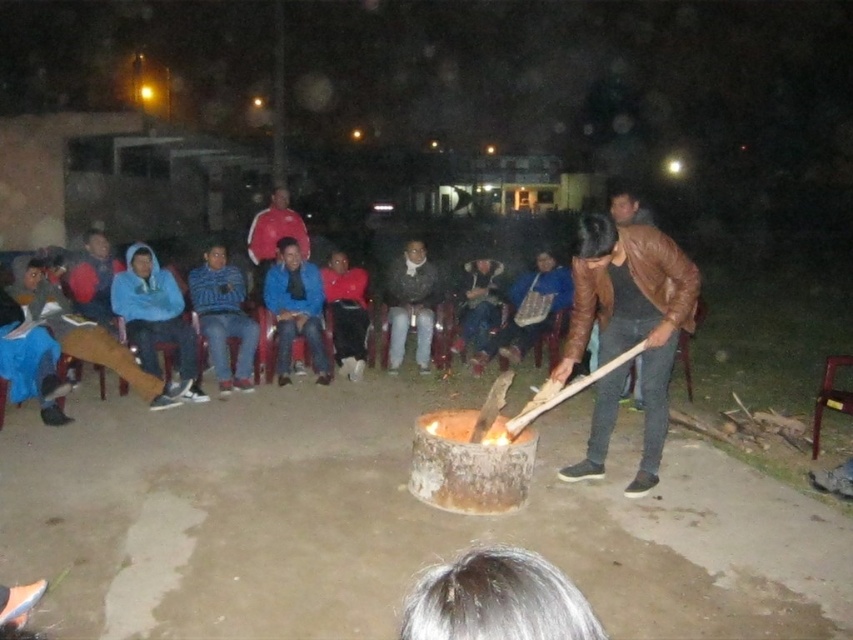
Question: Based on their relative distances, which object is farther from the red sweater at center?

Choices:
 (A) dark brown leather jacket at center
 (B) brown leather jacket at center
 (C) blue fleece jacket at center

Answer: (B)

Question: Is dark brown leather jacket at center wider than red sweater at center?

Choices:
 (A) yes
 (B) no

Answer: (A)

Question: Can you confirm if brown leather jacket at center is positioned to the right of red sweater at center?

Choices:
 (A) yes
 (B) no

Answer: (A)

Question: Estimate the real-world distances between objects in this image. Which object is closer to the dark brown leather jacket at center?

Choices:
 (A) brown leather jacket at center
 (B) blue fleece jacket at center
 (C) blue knitwear at center
 (D) red sweater at center

Answer: (D)

Question: Can you confirm if brown leather jacket at center is bigger than dark brown leather jacket at center?

Choices:
 (A) no
 (B) yes

Answer: (B)

Question: Which point is farther to the camera?

Choices:
 (A) (409, 304)
 (B) (596, 316)

Answer: (A)